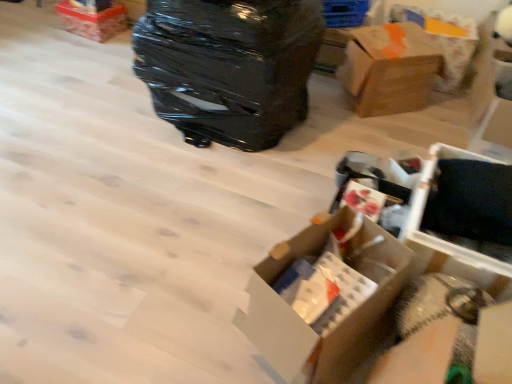
At what (x,y) coordinates should I click in order to perform the action: click on free spot to the left of white cardboard box at center, which ranks as the third box in top-to-bottom order. Please return your answer as a coordinate pair (x, y). The width and height of the screenshot is (512, 384). Looking at the image, I should click on (194, 302).